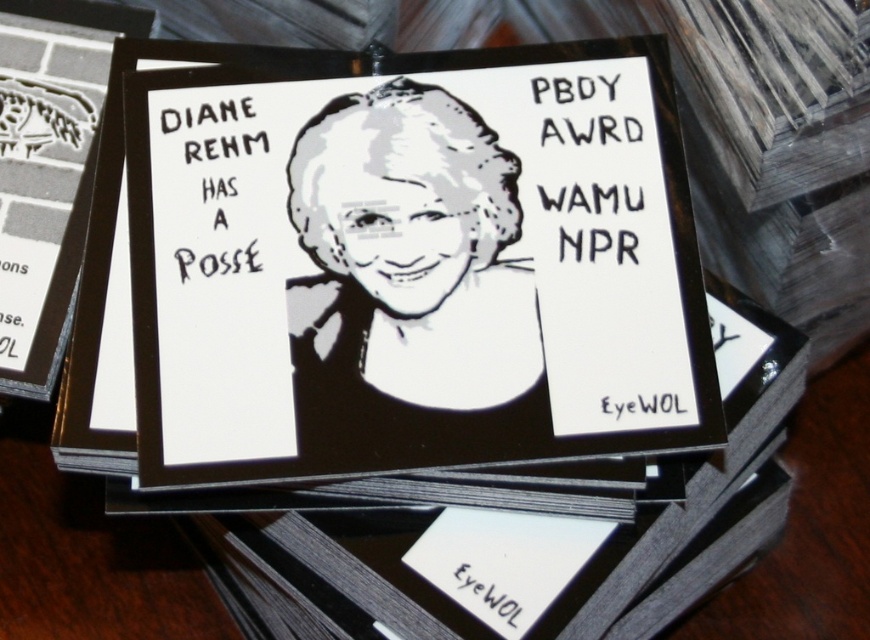
You are holding a ruler and want to measure the distance from your eye level to the point at coordinates point (218, 156) in the image. What is the actual distance in meters?

The distance of point (218, 156) from camera is 1.06 meters, so the actual distance from your eye level to the point at coordinates point (218, 156) is 1.06 meters.

You are organizing a card display on a wooden table. You have a black paper card at center and a black paper portrait at center. Which one should you place to the left to ensure proper alignment?

You should place the black paper portrait at center to the left because the black paper card at center is to the right of it.